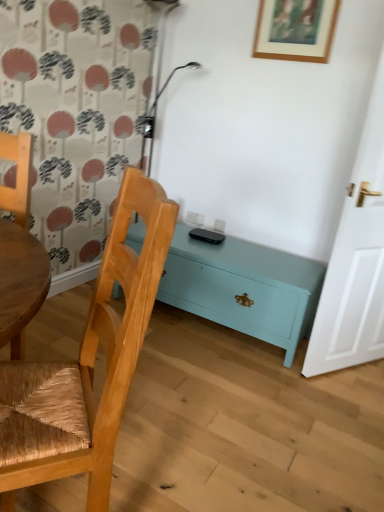
Question: Could you tell me if teal painted wood chest at lower center is turned towards wooden picture frame at upper center?

Choices:
 (A) no
 (B) yes

Answer: (A)

Question: Considering the relative positions of teal painted wood chest at lower center and wooden picture frame at upper center in the image provided, is teal painted wood chest at lower center to the left of wooden picture frame at upper center from the viewer's perspective?

Choices:
 (A) yes
 (B) no

Answer: (A)

Question: Is teal painted wood chest at lower center closer to camera compared to wooden picture frame at upper center?

Choices:
 (A) yes
 (B) no

Answer: (A)

Question: Is teal painted wood chest at lower center shorter than wooden picture frame at upper center?

Choices:
 (A) yes
 (B) no

Answer: (B)

Question: Can you confirm if teal painted wood chest at lower center is taller than wooden picture frame at upper center?

Choices:
 (A) yes
 (B) no

Answer: (A)

Question: From the image's perspective, is wooden picture frame at upper center positioned above or below teal painted wood chest at lower center?

Choices:
 (A) above
 (B) below

Answer: (A)

Question: From a real-world perspective, is wooden picture frame at upper center physically located above or below teal painted wood chest at lower center?

Choices:
 (A) below
 (B) above

Answer: (B)

Question: Which is correct: wooden picture frame at upper center is inside teal painted wood chest at lower center, or outside of it?

Choices:
 (A) inside
 (B) outside

Answer: (B)

Question: Is wooden picture frame at upper center wider or thinner than teal painted wood chest at lower center?

Choices:
 (A) thin
 (B) wide

Answer: (A)

Question: In terms of height, does woven wood chair at left, which ranks as the first chair in right-to-left order, look taller or shorter compared to teal painted wood chest at lower center?

Choices:
 (A) short
 (B) tall

Answer: (B)

Question: Considering the relative positions of woven wood chair at left, the second chair from the left, and teal painted wood chest at lower center in the image provided, is woven wood chair at left, the second chair from the left, to the left or to the right of teal painted wood chest at lower center?

Choices:
 (A) right
 (B) left

Answer: (B)

Question: From a real-world perspective, is woven wood chair at left, the second chair from the left, above or below teal painted wood chest at lower center?

Choices:
 (A) below
 (B) above

Answer: (B)

Question: Considering the positions of woven wood chair at left, the second chair from the left, and teal painted wood chest at lower center in the image, is woven wood chair at left, the second chair from the left, bigger or smaller than teal painted wood chest at lower center?

Choices:
 (A) big
 (B) small

Answer: (B)

Question: From a real-world perspective, is teal painted wood chest at lower center positioned above or below woven wood chair at left, which ranks as the first chair in right-to-left order?

Choices:
 (A) above
 (B) below

Answer: (B)

Question: Considering the positions of teal painted wood chest at lower center and woven wood chair at left, which ranks as the first chair in right-to-left order, in the image, is teal painted wood chest at lower center bigger or smaller than woven wood chair at left, which ranks as the first chair in right-to-left order,?

Choices:
 (A) big
 (B) small

Answer: (A)